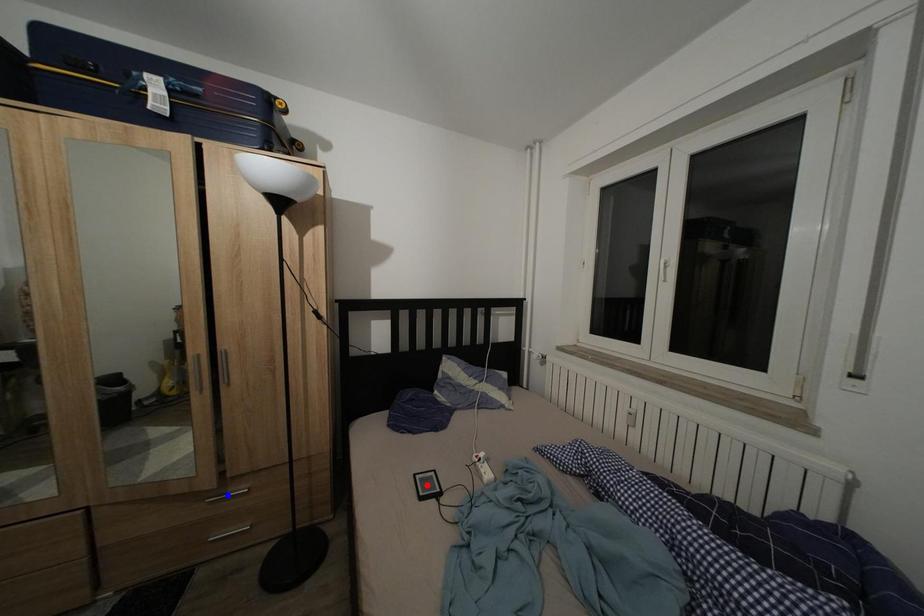
Question: Which of the two points in the image is closer to the camera?

Choices:
 (A) Blue point is closer.
 (B) Red point is closer.

Answer: (A)